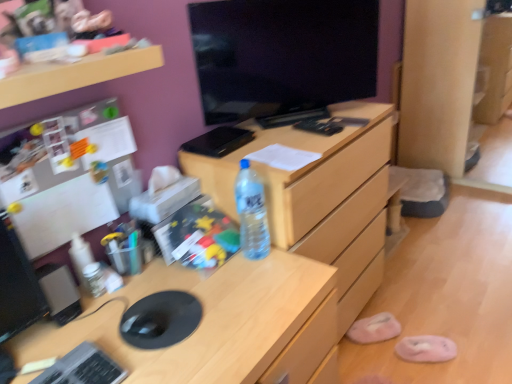
The width and height of the screenshot is (512, 384). Find the location of `free spot in front of translucent plastic water bottle at center`. free spot in front of translucent plastic water bottle at center is located at coordinates (256, 281).